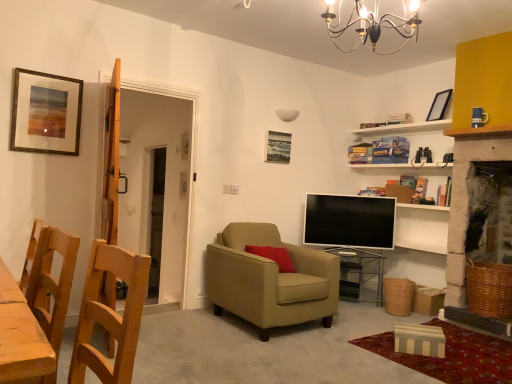
Question: Is wooden chair at left, which appears as the 3th chair when viewed from the back, smaller than matte black screen at center?

Choices:
 (A) no
 (B) yes

Answer: (A)

Question: Does wooden chair at left, which appears as the 3th chair when viewed from the back, have a greater height compared to matte black screen at center?

Choices:
 (A) no
 (B) yes

Answer: (A)

Question: From the image's perspective, would you say wooden chair at left, which appears as the 3th chair when viewed from the back, is shown under matte black screen at center?

Choices:
 (A) yes
 (B) no

Answer: (A)

Question: Can you confirm if wooden chair at left, which appears as the 3th chair when viewed from the back, is thinner than matte black screen at center?

Choices:
 (A) yes
 (B) no

Answer: (B)

Question: Considering the relative sizes of wooden chair at left, which appears as the 3th chair when viewed from the back, and matte black screen at center in the image provided, is wooden chair at left, which appears as the 3th chair when viewed from the back, bigger than matte black screen at center?

Choices:
 (A) yes
 (B) no

Answer: (A)

Question: In terms of size, does gold-framed painting at upper left, which ranks as the first picture frame in front-to-back order, appear bigger or smaller than metallic chandelier at upper center?

Choices:
 (A) small
 (B) big

Answer: (A)

Question: From a real-world perspective, relative to metallic chandelier at upper center, is gold-framed painting at upper left, the third picture frame from the right, vertically above or below?

Choices:
 (A) above
 (B) below

Answer: (B)

Question: Is gold-framed painting at upper left, the third picture frame from the right, in front of or behind metallic chandelier at upper center in the image?

Choices:
 (A) front
 (B) behind

Answer: (B)

Question: Considering the positions of gold-framed painting at upper left, which ranks as the first picture frame in front-to-back order, and metallic chandelier at upper center in the image, is gold-framed painting at upper left, which ranks as the first picture frame in front-to-back order, wider or thinner than metallic chandelier at upper center?

Choices:
 (A) thin
 (B) wide

Answer: (A)

Question: Is metallic chandelier at upper center inside or outside of matte black screen at center?

Choices:
 (A) outside
 (B) inside

Answer: (A)

Question: Is metallic chandelier at upper center in front of or behind matte black screen at center in the image?

Choices:
 (A) behind
 (B) front

Answer: (B)

Question: From the image's perspective, is metallic chandelier at upper center located above or below matte black screen at center?

Choices:
 (A) below
 (B) above

Answer: (B)

Question: Looking at the image, does metallic chandelier at upper center seem bigger or smaller compared to matte black screen at center?

Choices:
 (A) big
 (B) small

Answer: (A)

Question: In the image, is wooden chair at left, which appears as the 3th chair when viewed from the back, positioned in front of or behind transparent glass table at center?

Choices:
 (A) front
 (B) behind

Answer: (A)

Question: Considering the positions of wooden chair at left, which appears as the 3th chair when viewed from the back, and transparent glass table at center in the image, is wooden chair at left, which appears as the 3th chair when viewed from the back, bigger or smaller than transparent glass table at center?

Choices:
 (A) small
 (B) big

Answer: (A)